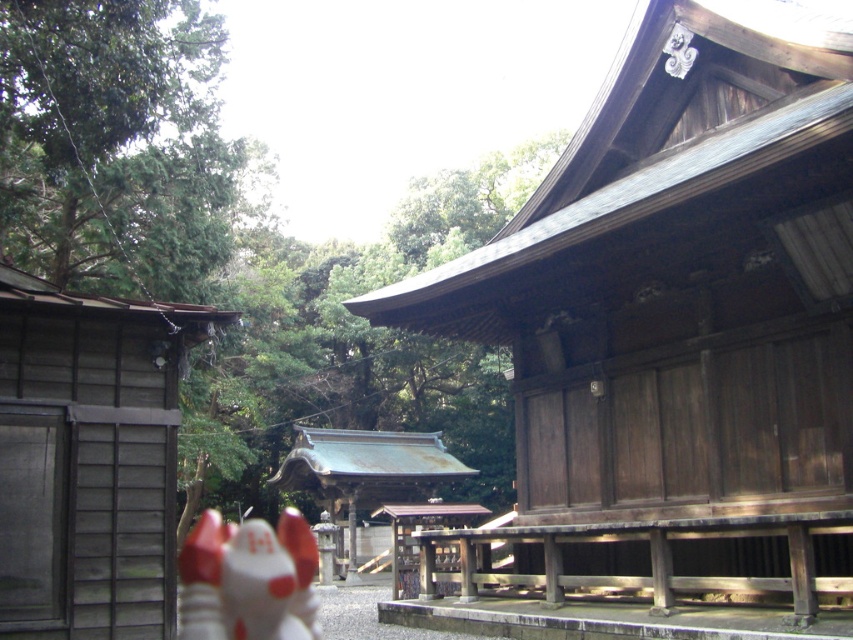
Is brown wooden hut at center below rusty metal shrine at center?

Incorrect, brown wooden hut at center is not positioned below rusty metal shrine at center.

Does brown wooden hut at center appear on the right side of rusty metal shrine at center?

Correct, you'll find brown wooden hut at center to the right of rusty metal shrine at center.

Who is more distant from viewer, (636, 387) or (351, 524)?

Point (351, 524)

Locate an element on the screen. brown wooden hut at center is located at coordinates click(675, 324).

Can you confirm if brown wooden hut at center is positioned to the right of white glossy fox at lower left?

Yes, brown wooden hut at center is to the right of white glossy fox at lower left.

Is brown wooden hut at center positioned behind white glossy fox at lower left?

No.

Between point (815, 61) and point (260, 525), which one is positioned in front?

Positioned in front is point (815, 61).

Find the location of a particular element. The width and height of the screenshot is (853, 640). brown wooden hut at center is located at coordinates (675, 324).

Is point (10, 460) farther from camera compared to point (425, 440)?

That is False.

Between wooden hut at left and rusty metal shrine at center, which one is positioned higher?

wooden hut at left

Does point (48, 621) come in front of point (433, 492)?

Yes, it is in front of point (433, 492).

Where is `wooden hut at left`? wooden hut at left is located at coordinates (90, 460).